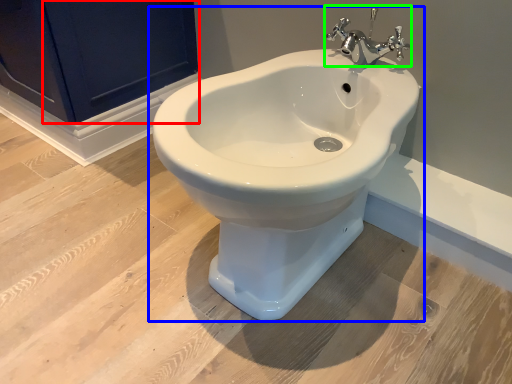
Question: Based on their relative distances, which object is farther from screen door (highlighted by a red box)? Choose from toilet (highlighted by a blue box) and tap (highlighted by a green box).

Choices:
 (A) toilet
 (B) tap

Answer: (A)